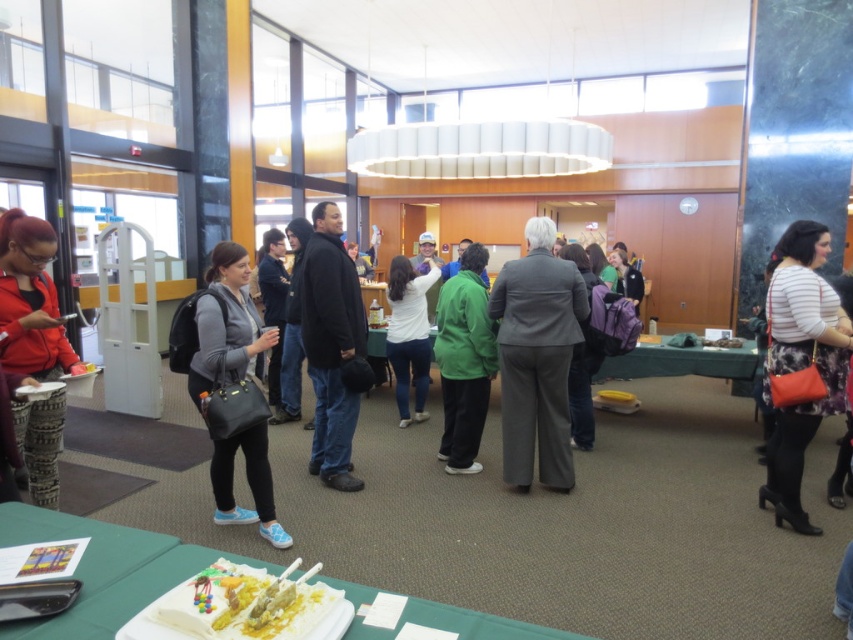
Is matte red jacket at left to the left of white matte shirt at center from the viewer's perspective?

Indeed, matte red jacket at left is positioned on the left side of white matte shirt at center.

Image resolution: width=853 pixels, height=640 pixels. What do you see at coordinates (30, 301) in the screenshot?
I see `matte red jacket at left` at bounding box center [30, 301].

I want to click on matte red jacket at left, so (x=30, y=301).

Is point (323, 579) farther from viewer compared to point (314, 612)?

Yes, it is behind point (314, 612).

Who is positioned more to the left, white paper plate at lower center or yellow frosted cake at lower center?

Positioned to the left is white paper plate at lower center.

Describe the element at coordinates (105, 570) in the screenshot. I see `white paper plate at lower center` at that location.

I want to click on white paper plate at lower center, so click(x=105, y=570).

Between point (22, 364) and point (460, 422), which one is positioned in front?

Point (22, 364)

Locate an element on the screen. The image size is (853, 640). matte red jacket at left is located at coordinates (30, 301).